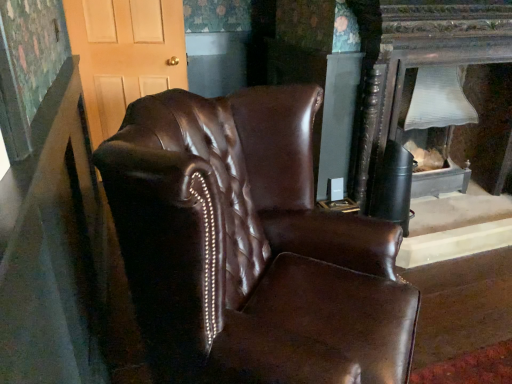
Question: Can you confirm if matte wood door at upper left is shorter than matte white lampshade at right?

Choices:
 (A) yes
 (B) no

Answer: (B)

Question: From a real-world perspective, is matte wood door at upper left over matte white lampshade at right?

Choices:
 (A) yes
 (B) no

Answer: (A)

Question: Is matte wood door at upper left closer to camera compared to matte white lampshade at right?

Choices:
 (A) yes
 (B) no

Answer: (B)

Question: From the image's perspective, is matte wood door at upper left located beneath matte white lampshade at right?

Choices:
 (A) yes
 (B) no

Answer: (B)

Question: Considering the relative sizes of matte wood door at upper left and matte white lampshade at right in the image provided, is matte wood door at upper left thinner than matte white lampshade at right?

Choices:
 (A) yes
 (B) no

Answer: (A)

Question: Is matte wood door at upper left positioned far away from matte white lampshade at right?

Choices:
 (A) no
 (B) yes

Answer: (B)

Question: Can you confirm if matte white lampshade at right is positioned to the right of shiny brown leather armchair at center?

Choices:
 (A) yes
 (B) no

Answer: (A)

Question: From a real-world perspective, is matte white lampshade at right under shiny brown leather armchair at center?

Choices:
 (A) yes
 (B) no

Answer: (A)

Question: Does matte white lampshade at right have a smaller size compared to shiny brown leather armchair at center?

Choices:
 (A) yes
 (B) no

Answer: (A)

Question: Is matte white lampshade at right surrounding shiny brown leather armchair at center?

Choices:
 (A) no
 (B) yes

Answer: (A)

Question: Is matte white lampshade at right wider than shiny brown leather armchair at center?

Choices:
 (A) no
 (B) yes

Answer: (A)

Question: Is matte white lampshade at right outside of shiny brown leather armchair at center?

Choices:
 (A) no
 (B) yes

Answer: (B)

Question: From the image's perspective, is shiny brown leather armchair at center below matte wood door at upper left?

Choices:
 (A) no
 (B) yes

Answer: (B)